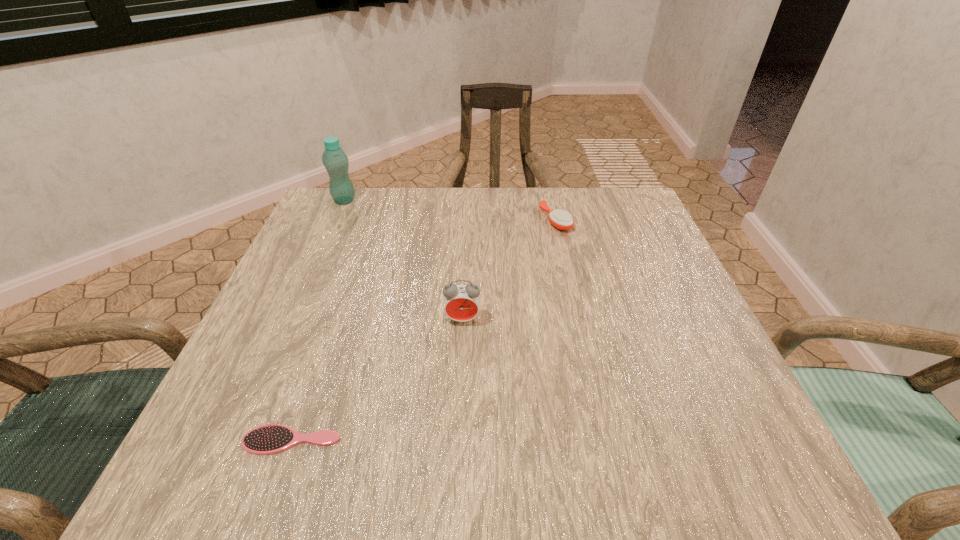
You are a GUI agent. You are given a task and a screenshot of the screen. Output one action in this format:
    pyautogui.click(x=<x>, y=<y>)
    Task: Click on the free space in the image that satisfies the following two spatial constraints: 1. on the back side of the taller hairbrush; 2. at the front cap of the farthest object
    The height and width of the screenshot is (540, 960).
    Given the screenshot: What is the action you would take?
    pyautogui.click(x=551, y=200)

I want to click on blank area in the image that satisfies the following two spatial constraints: 1. at the front cap of the water bottle; 2. on the left side of the nearer hairbrush, so click(239, 440).